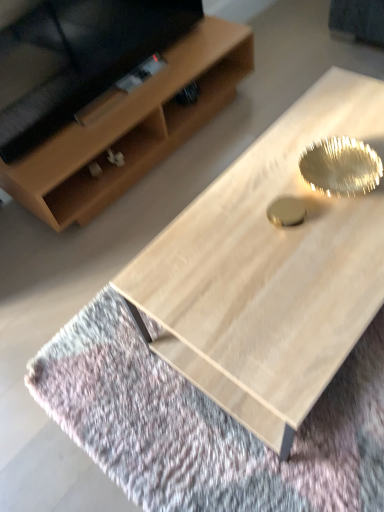
I want to click on empty space that is ontop of light brown wood shelf at upper left (from a real-world perspective), so click(127, 89).